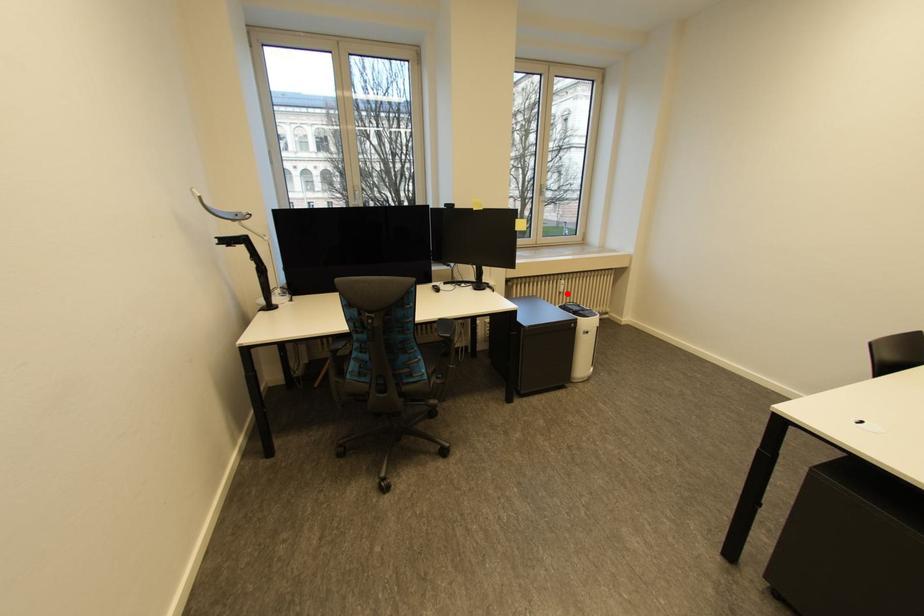
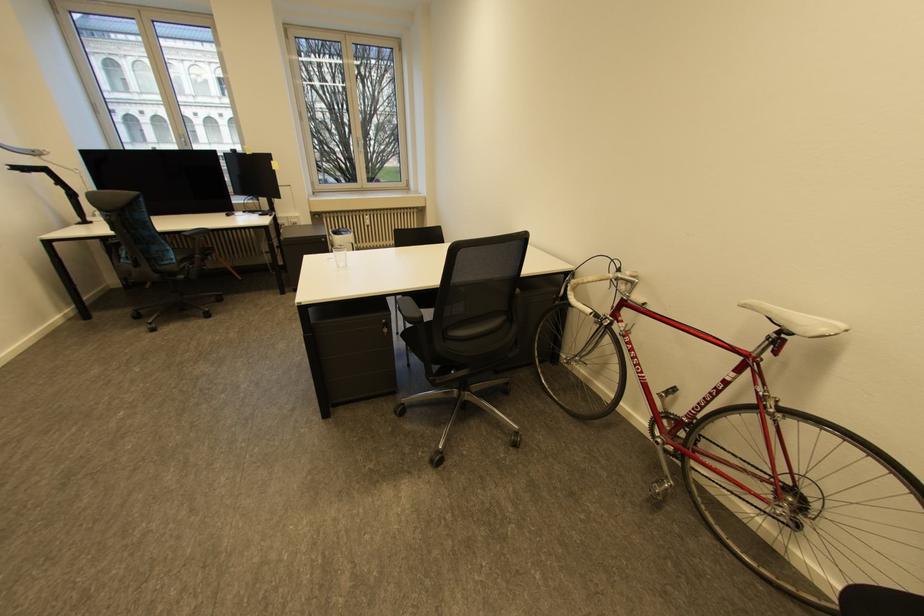
Question: A red point is marked in image1. In image2, is the corresponding 3D point closer to the camera or farther? Reply with the corresponding letter.

Choices:
 (A) The corresponding 3D point is closer.
 (B) The corresponding 3D point is farther.

Answer: (B)